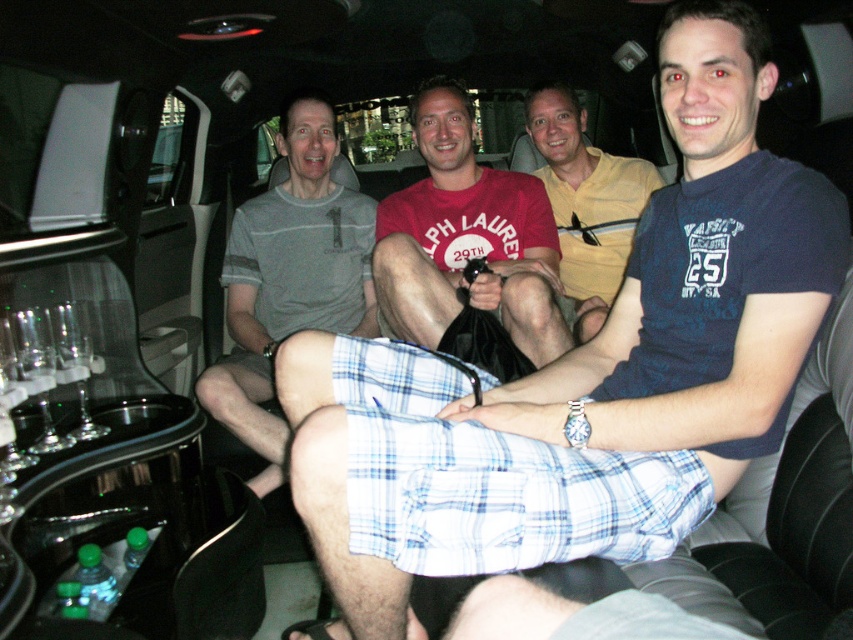
Question: Can you confirm if gray striped shirt at center is positioned to the left of yellow cotton shirt at center?

Choices:
 (A) yes
 (B) no

Answer: (A)

Question: Considering the real-world distances, which object is closest to the gray striped shirt at center?

Choices:
 (A) yellow cotton shirt at center
 (B) matte red t-shirt at center

Answer: (B)

Question: Which of the following is the farthest from the observer?

Choices:
 (A) (273, 317)
 (B) (440, 209)

Answer: (A)

Question: Where is matte red t-shirt at center located in relation to yellow cotton shirt at center in the image?

Choices:
 (A) below
 (B) above

Answer: (A)

Question: Is the position of gray striped shirt at center less distant than that of yellow cotton shirt at center?

Choices:
 (A) yes
 (B) no

Answer: (A)

Question: Based on their relative distances, which object is nearer to the matte red t-shirt at center?

Choices:
 (A) gray striped shirt at center
 (B) yellow cotton shirt at center

Answer: (B)